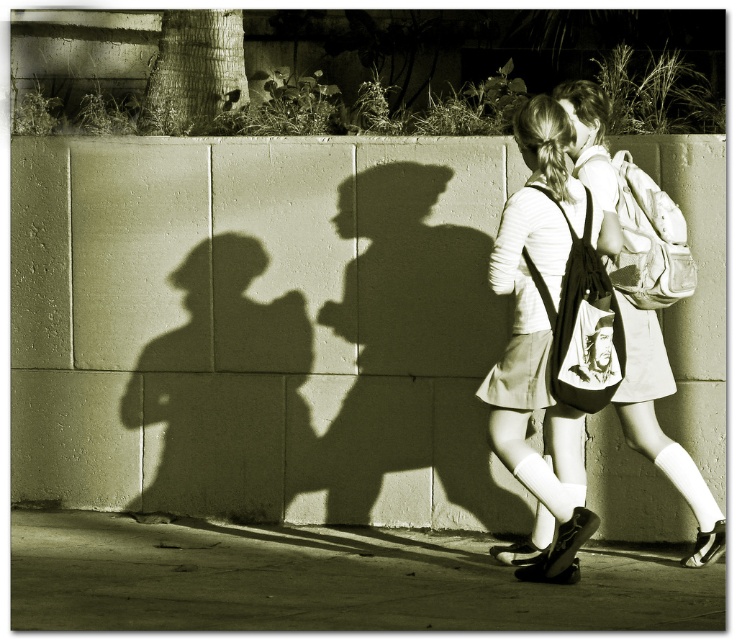
What do you see at coordinates (539, 344) in the screenshot? I see `matte white backpack at center` at bounding box center [539, 344].

Does matte white backpack at center come in front of matte fabric backpack at center?

Yes, it is.

What do you see at coordinates (539, 344) in the screenshot? I see `matte white backpack at center` at bounding box center [539, 344].

Image resolution: width=737 pixels, height=640 pixels. Find the location of `matte white backpack at center`. matte white backpack at center is located at coordinates (539, 344).

This screenshot has width=737, height=640. Describe the element at coordinates (539, 344) in the screenshot. I see `matte white backpack at center` at that location.

Between matte white backpack at center and smooth black hoodie at center, which one appears on the left side from the viewer's perspective?

matte white backpack at center is more to the left.

Which is in front, point (503, 381) or point (579, 316)?

Positioned in front is point (579, 316).

You are a GUI agent. You are given a task and a screenshot of the screen. Output one action in this format:
    pyautogui.click(x=<x>, y=<y>)
    Task: Click on the matte white backpack at center
    
    Given the screenshot: What is the action you would take?
    pyautogui.click(x=539, y=344)

Who is higher up, smooth concrete pavement at lower center or matte fabric backpack at center?

matte fabric backpack at center is higher up.

Does smooth concrete pavement at lower center have a greater width compared to matte fabric backpack at center?

Yes.

Find the location of a particular element. smooth concrete pavement at lower center is located at coordinates (324, 580).